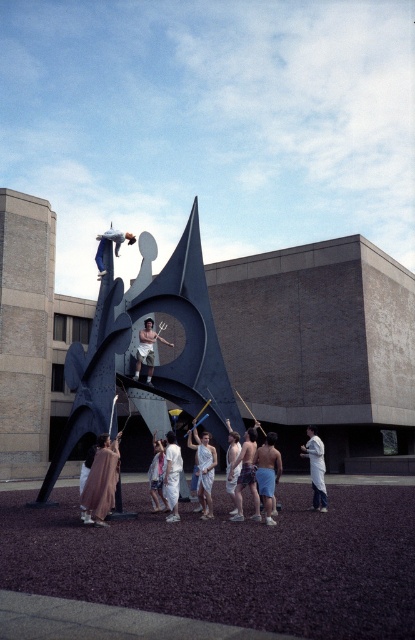
Question: Is white clothed figure at center wider than smooth white statue at center?

Choices:
 (A) no
 (B) yes

Answer: (A)

Question: Does matte brown robe at lower left appear under white cotton shorts at center?

Choices:
 (A) no
 (B) yes

Answer: (A)

Question: Which of the following is the closest to the observer?

Choices:
 (A) smooth white statue at center
 (B) metallic hammer at upper left

Answer: (A)

Question: Does white clothed figure at center appear under white cotton shorts at center?

Choices:
 (A) yes
 (B) no

Answer: (A)

Question: Which of the following is the closest to the observer?

Choices:
 (A) white cotton shorts at center
 (B) white lab coat at center

Answer: (B)

Question: Estimate the real-world distances between objects in this image. Which object is farther from the matte brown robe at lower left?

Choices:
 (A) white lab coat at center
 (B) white cotton shorts at center
 (C) blue shorts at center
 (D) light brown fabric shorts at center

Answer: (A)